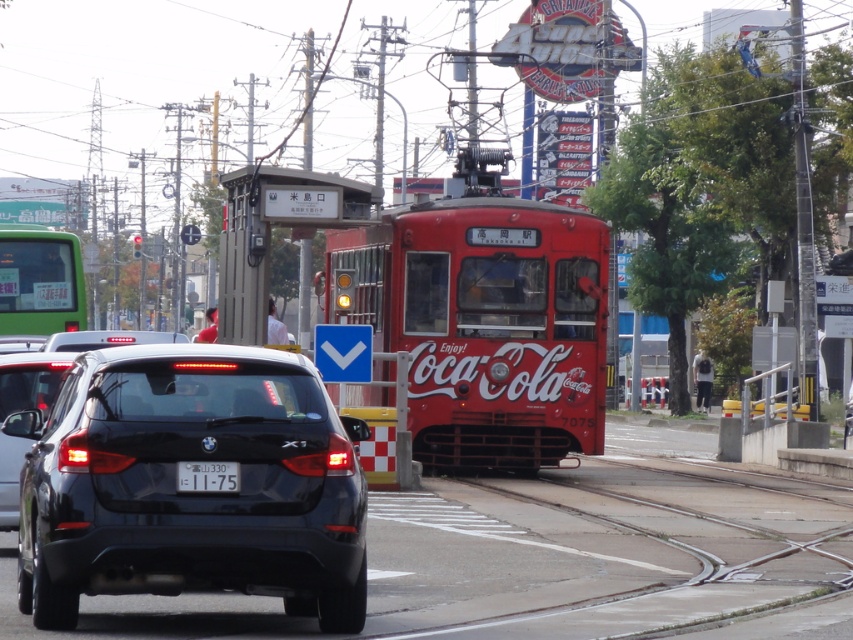
The image size is (853, 640). What do you see at coordinates (190, 492) in the screenshot? I see `black matte bmw x1 at center` at bounding box center [190, 492].

Between black matte bmw x1 at center and white plastic license plate at center, which one has more height?

Standing taller between the two is black matte bmw x1 at center.

Who is more forward, (218, 436) or (218, 483)?

Positioned in front is point (218, 436).

Find the location of a particular element. black matte bmw x1 at center is located at coordinates (190, 492).

Is black glossy car at lower left bigger than white plastic license plate at center?

Yes, black glossy car at lower left is bigger than white plastic license plate at center.

The image size is (853, 640). What do you see at coordinates (30, 380) in the screenshot? I see `black glossy car at lower left` at bounding box center [30, 380].

Between point (3, 525) and point (219, 490), which one is positioned behind?

Point (3, 525)

In order to click on black glossy car at lower left in this screenshot , I will do `click(30, 380)`.

Is black matte bmw x1 at center below black glossy car at lower left?

Yes, black matte bmw x1 at center is below black glossy car at lower left.

Who is more distant from viewer, (343, 576) or (9, 444)?

Positioned behind is point (9, 444).

Identify the location of black matte bmw x1 at center. (190, 492).